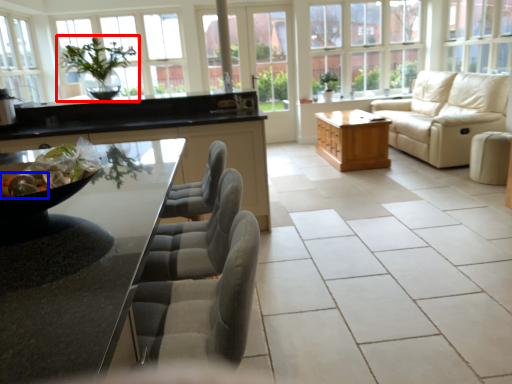
Question: Which point is closer to the camera, houseplant (highlighted by a red box) or food (highlighted by a blue box)?

Choices:
 (A) houseplant
 (B) food

Answer: (B)